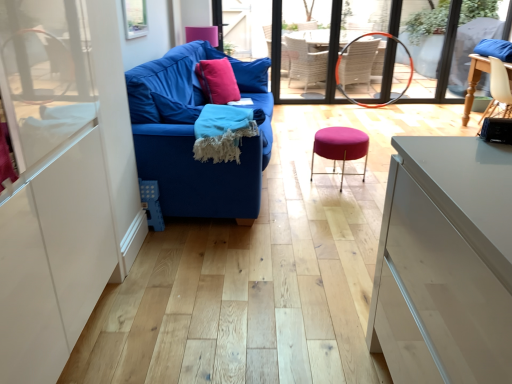
Question: Should I look upward or downward to see teal woven blanket at center?

Choices:
 (A) up
 (B) down

Answer: (A)

Question: Can we say wooden chair at right lies outside matte wicker armchair at center?

Choices:
 (A) no
 (B) yes

Answer: (B)

Question: Is wooden chair at right wider than matte wicker armchair at center?

Choices:
 (A) no
 (B) yes

Answer: (B)

Question: Can you confirm if wooden chair at right is shorter than matte wicker armchair at center?

Choices:
 (A) no
 (B) yes

Answer: (B)

Question: Are wooden chair at right and matte wicker armchair at center far apart?

Choices:
 (A) no
 (B) yes

Answer: (B)

Question: From the image's perspective, is wooden chair at right over matte wicker armchair at center?

Choices:
 (A) yes
 (B) no

Answer: (B)

Question: Is wooden chair at right taller than matte wicker armchair at center?

Choices:
 (A) yes
 (B) no

Answer: (B)

Question: From the image's perspective, is pink fabric pillow at center above blue fabric couch at left?

Choices:
 (A) yes
 (B) no

Answer: (A)

Question: Can you confirm if pink fabric pillow at center is shorter than blue fabric couch at left?

Choices:
 (A) yes
 (B) no

Answer: (A)

Question: From the image's perspective, is pink fabric pillow at center under blue fabric couch at left?

Choices:
 (A) yes
 (B) no

Answer: (B)

Question: Does pink fabric pillow at center appear on the right side of blue fabric couch at left?

Choices:
 (A) no
 (B) yes

Answer: (B)

Question: Can you confirm if pink fabric pillow at center is wider than blue fabric couch at left?

Choices:
 (A) yes
 (B) no

Answer: (B)

Question: From a real-world perspective, is pink fabric pillow at center physically below blue fabric couch at left?

Choices:
 (A) yes
 (B) no

Answer: (B)

Question: From a real-world perspective, is purple fabric stool at center beneath matte pink throw pillow at center?

Choices:
 (A) yes
 (B) no

Answer: (A)